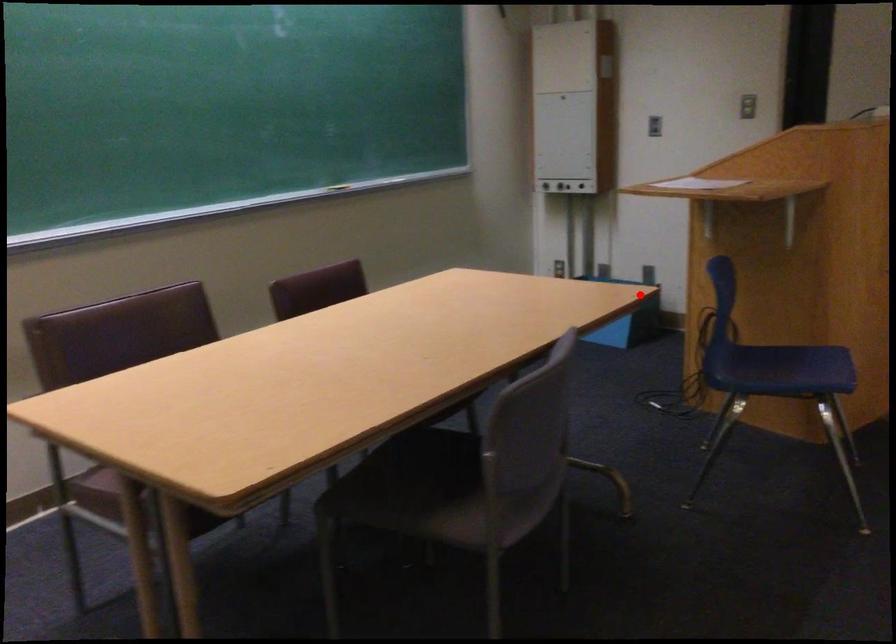
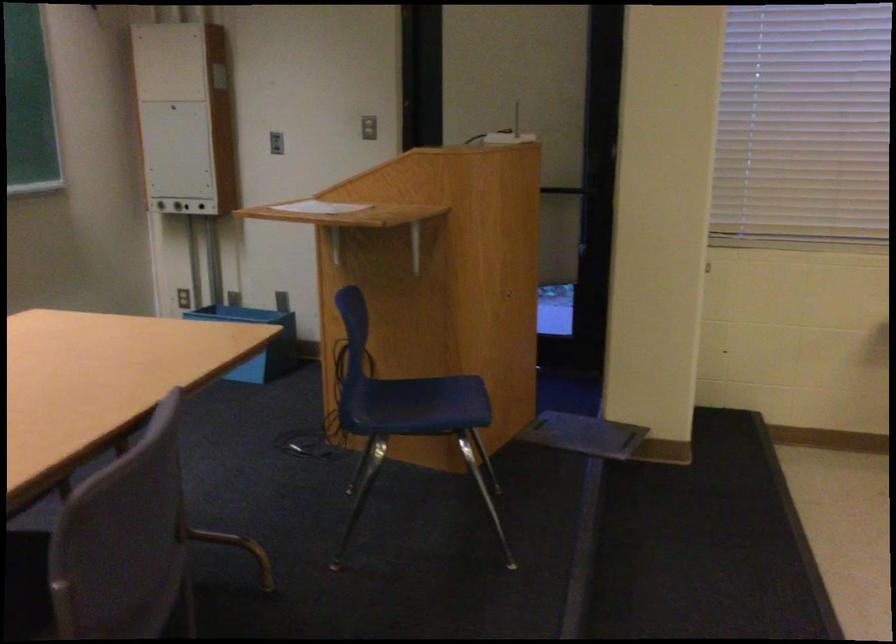
Locate, in the second image, the point that corresponds to the highlighted location in the first image.

(256, 341)